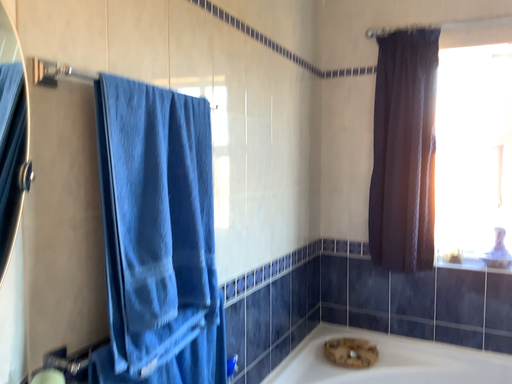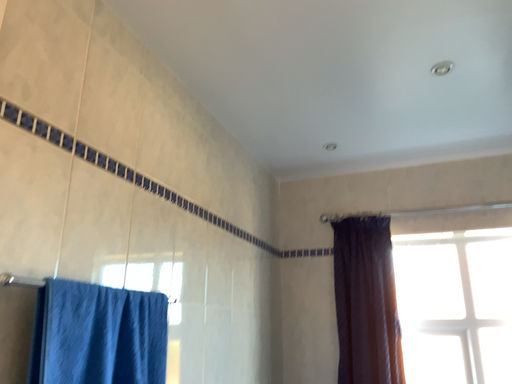
Question: Which way did the camera rotate in the video?

Choices:
 (A) rotated right
 (B) rotated left

Answer: (A)